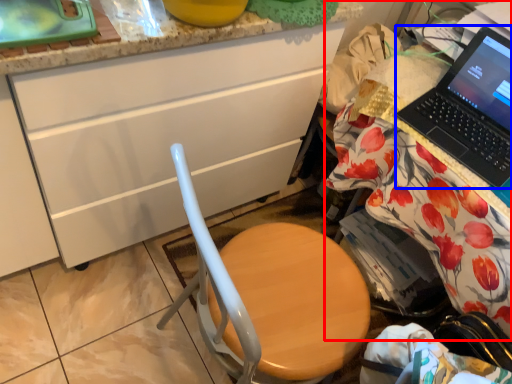
Question: Which of the following is the closest to the observer, desk (highlighted by a red box) or laptop (highlighted by a blue box)?

Choices:
 (A) desk
 (B) laptop

Answer: (A)